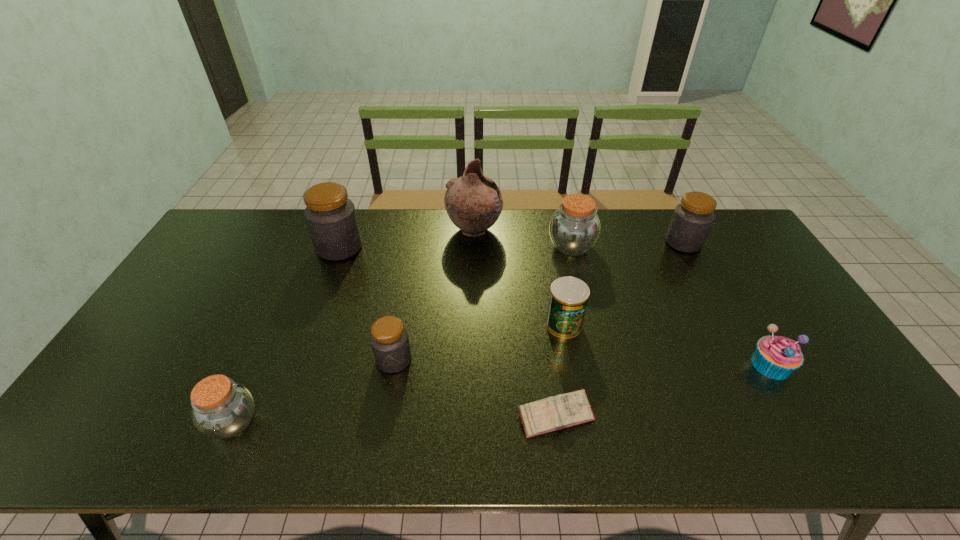
This screenshot has height=540, width=960. Find the location of `the smallest gray jar`. the smallest gray jar is located at coordinates (389, 339).

Identify the location of the left brown jar. Image resolution: width=960 pixels, height=540 pixels. (222, 408).

Identify the location of the smaller brown jar. This screenshot has width=960, height=540. (222, 408).

Identify the location of muffin. (776, 357).

At what (x,y) coordinates should I click in order to perform the action: click on pink diary. Please return your answer as a coordinate pair (x, y). This screenshot has height=540, width=960. Looking at the image, I should click on (569, 409).

Where is `diary`? This screenshot has height=540, width=960. diary is located at coordinates (569, 409).

This screenshot has height=540, width=960. Find the location of `free space located 0.170m from the spout of the fourth object from left to right`. free space located 0.170m from the spout of the fourth object from left to right is located at coordinates (549, 230).

At what (x,y) coordinates should I click in order to perform the action: click on vacant space located on the surface of the leftmost gray jar near the warning symbol. Please return your answer as a coordinate pair (x, y). Looking at the image, I should click on (473, 247).

Image resolution: width=960 pixels, height=540 pixels. I want to click on vacant region located 0.080m on the surface of the rightmost gray jar near the warning symbol, so click(642, 242).

Find the location of `free location located on the surface of the rightmost gray jar near the warning symbol`. free location located on the surface of the rightmost gray jar near the warning symbol is located at coordinates (564, 242).